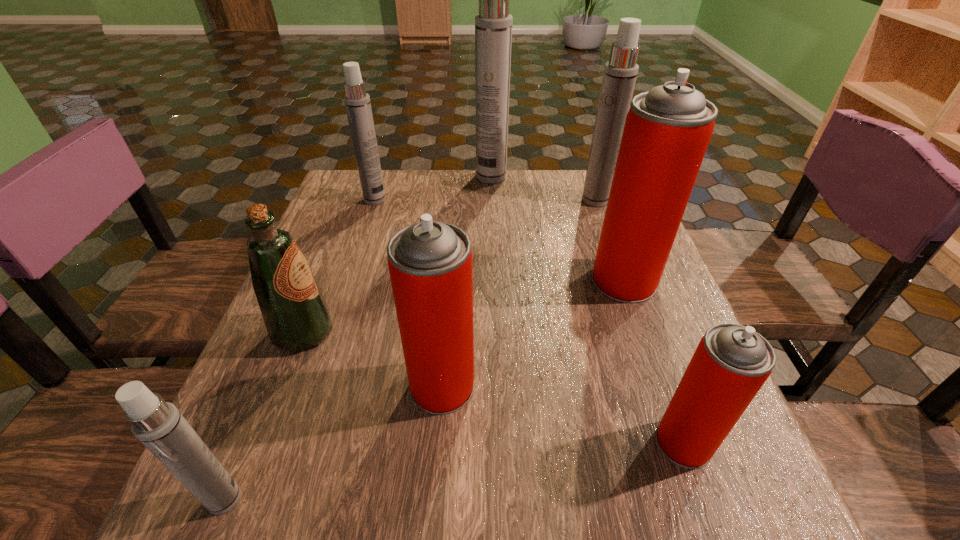
Identify the location of blank space located on the front-facing side of the fifth farthest object. The height and width of the screenshot is (540, 960). (405, 332).

Find the location of a particular element. Image resolution: width=960 pixels, height=540 pixels. free space located on the back of the smallest red aerosol can is located at coordinates (662, 382).

This screenshot has height=540, width=960. I want to click on vacant space located on the back of the nearest object, so click(289, 342).

This screenshot has height=540, width=960. I want to click on olive oil at the left edge, so click(295, 313).

This screenshot has width=960, height=540. Identify the location of object located in the far left corner section of the desktop. (357, 102).

Where is `object at the near left corner`? This screenshot has height=540, width=960. object at the near left corner is located at coordinates (158, 425).

Find the location of a particular element. The height and width of the screenshot is (540, 960). object that is at the far right corner is located at coordinates (620, 73).

In order to click on object that is at the near right corner in this screenshot , I will do `click(731, 363)`.

Where is `vacant space at the far edge of the desktop`? The width and height of the screenshot is (960, 540). vacant space at the far edge of the desktop is located at coordinates (408, 171).

In the image, there is a desktop. At what (x,y) coordinates should I click in order to perform the action: click on vacant space at the near edge. Please return your answer as a coordinate pair (x, y). Looking at the image, I should click on (470, 485).